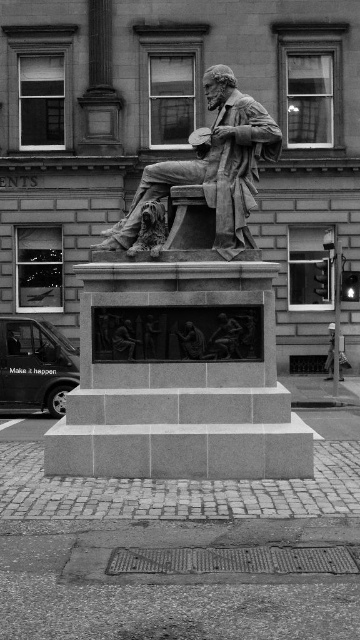
Can you confirm if bronze statue at center is taller than polished bronze statue at center?

Yes, bronze statue at center is taller than polished bronze statue at center.

Is bronze statue at center below polished bronze statue at center?

Yes.

What do you see at coordinates (185, 324) in the screenshot? The height and width of the screenshot is (640, 360). I see `bronze statue at center` at bounding box center [185, 324].

Locate an element on the screen. The image size is (360, 640). bronze statue at center is located at coordinates (185, 324).